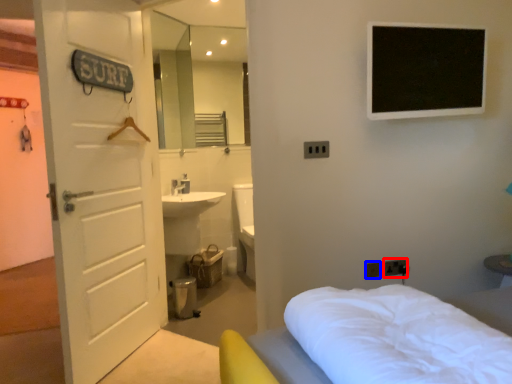
Question: Which of the following is the closest to the observer, electric outlet (highlighted by a red box) or electric outlet (highlighted by a blue box)?

Choices:
 (A) electric outlet
 (B) electric outlet

Answer: (B)